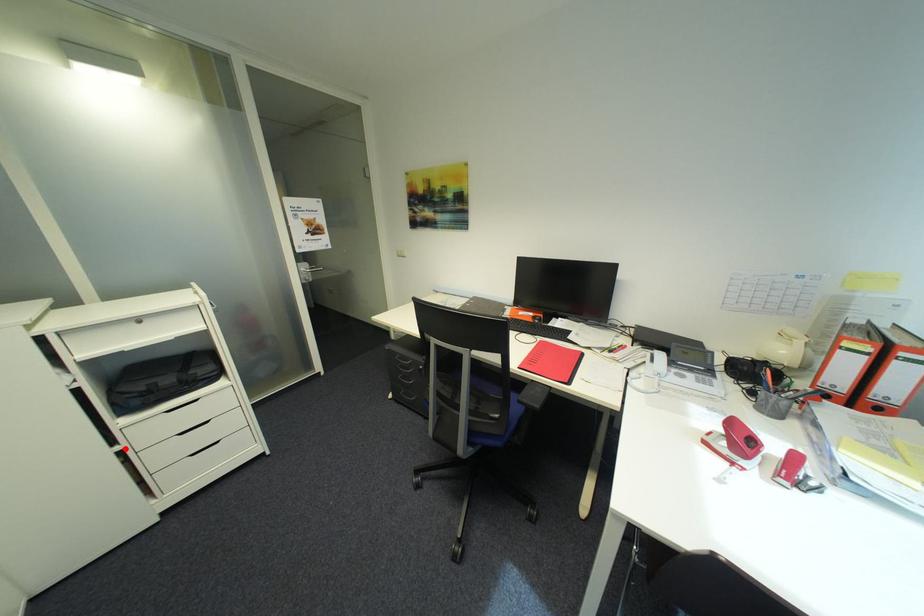
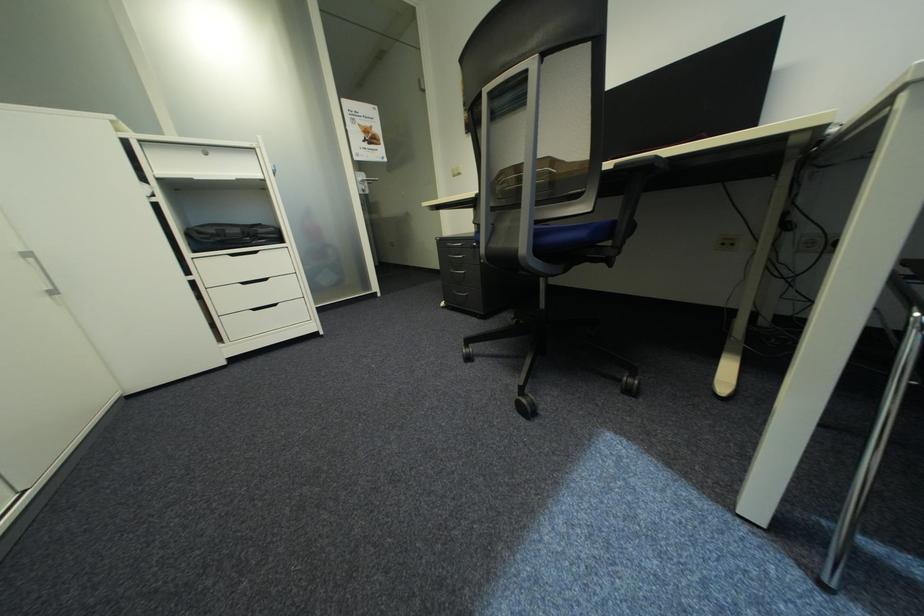
Find the pixel in the second image that matches the highlighted location in the first image.

(199, 278)